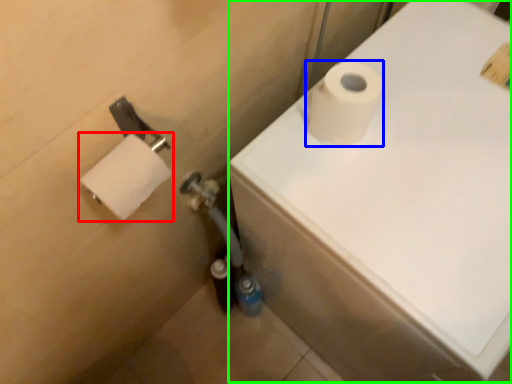
Question: Which is nearer to the toilet paper (highlighted by a red box)? toilet paper (highlighted by a blue box) or bath (highlighted by a green box).

Choices:
 (A) toilet paper
 (B) bath

Answer: (A)